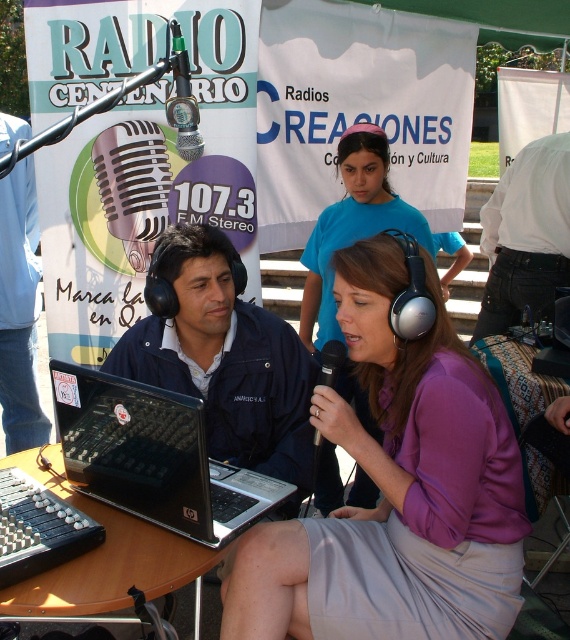
You are a photographer positioned to take a photo of the purple matte shirt at center and the black metallic microphone at center. Which object should you focus on first to ensure it appears sharp in the photo?

You should focus on the purple matte shirt at center first because it is closer to the viewer than the black metallic microphone at center, so focusing on the closer object ensures it will be sharp.

You are a photographer at the event and need to capture a photo of the purple matte shirt at center and the black plastic round table at center. From your current position, which object is higher in the frame?

The purple matte shirt at center is located above the black plastic round table at center, so it will appear higher in the frame.

You are a photographer at the event. You need to capture a photo where both the white cotton shirt at right and the black metallic microphone at center are clearly visible. Based on their positions, which object is higher in the frame?

The white cotton shirt at right is above the black metallic microphone at center, so it is higher in the frame.